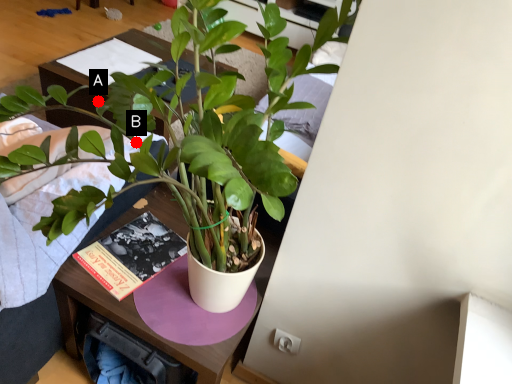
Question: Two points are circled on the image, labeled by A and B beside each circle. Which point is farther from the camera taking this photo?

Choices:
 (A) A is further
 (B) B is further

Answer: (A)